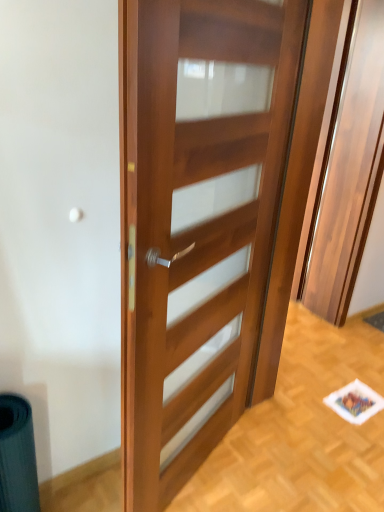
Identify the location of spots to the right of wooden door at center. (259, 477).